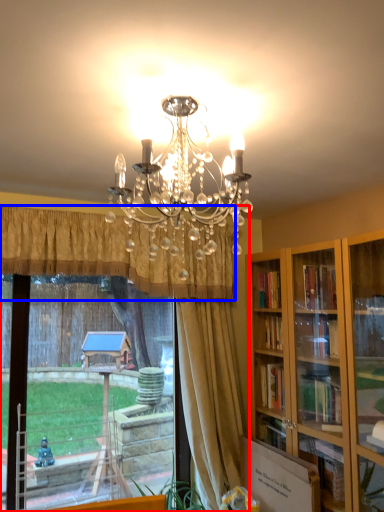
Question: Which object appears closest to the camera in this image, window (highlighted by a red box) or curtain (highlighted by a blue box)?

Choices:
 (A) window
 (B) curtain

Answer: (B)